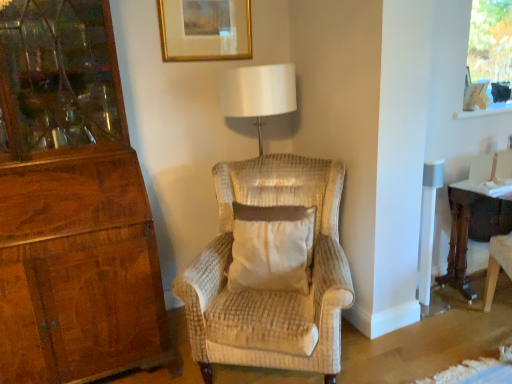
Question: Is the depth of transparent glass window screen at upper right greater than that of white textured pillow at center?

Choices:
 (A) no
 (B) yes

Answer: (B)

Question: Can you confirm if transparent glass window screen at upper right is taller than white textured pillow at center?

Choices:
 (A) yes
 (B) no

Answer: (A)

Question: Is transparent glass window screen at upper right wider than white textured pillow at center?

Choices:
 (A) yes
 (B) no

Answer: (B)

Question: Is transparent glass window screen at upper right not inside white textured pillow at center?

Choices:
 (A) yes
 (B) no

Answer: (A)

Question: From a real-world perspective, is transparent glass window screen at upper right on top of white textured pillow at center?

Choices:
 (A) no
 (B) yes

Answer: (B)

Question: From the image's perspective, relative to dark brown wood desk at right, is white textured pillow at center above or below?

Choices:
 (A) above
 (B) below

Answer: (B)

Question: Does point (303, 266) appear closer or farther from the camera than point (476, 296)?

Choices:
 (A) farther
 (B) closer

Answer: (B)

Question: From their relative heights in the image, would you say white textured pillow at center is taller or shorter than dark brown wood desk at right?

Choices:
 (A) short
 (B) tall

Answer: (A)

Question: In terms of width, does white textured pillow at center look wider or thinner when compared to dark brown wood desk at right?

Choices:
 (A) wide
 (B) thin

Answer: (B)

Question: In terms of height, does dark brown wood desk at right look taller or shorter compared to transparent glass window screen at upper right?

Choices:
 (A) short
 (B) tall

Answer: (B)

Question: From a real-world perspective, relative to transparent glass window screen at upper right, is dark brown wood desk at right vertically above or below?

Choices:
 (A) above
 (B) below

Answer: (B)

Question: From the image's perspective, relative to transparent glass window screen at upper right, is dark brown wood desk at right above or below?

Choices:
 (A) below
 (B) above

Answer: (A)

Question: Considering the positions of point (503, 195) and point (481, 59), is point (503, 195) closer or farther from the camera than point (481, 59)?

Choices:
 (A) closer
 (B) farther

Answer: (A)

Question: Is transparent glass window screen at upper right bigger or smaller than dark brown wood desk at right?

Choices:
 (A) big
 (B) small

Answer: (B)

Question: From the image's perspective, is transparent glass window screen at upper right located above or below dark brown wood desk at right?

Choices:
 (A) below
 (B) above

Answer: (B)